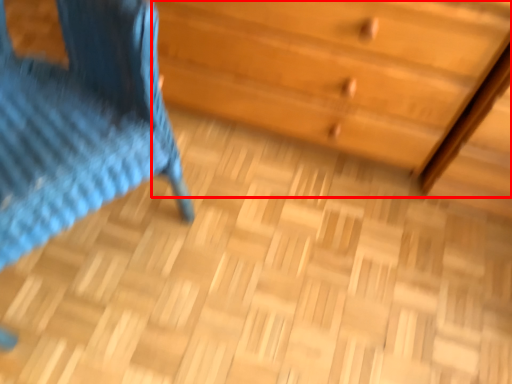
Question: In this image, where is chest of drawers (annotated by the red box) located relative to furniture?

Choices:
 (A) left
 (B) right

Answer: (B)